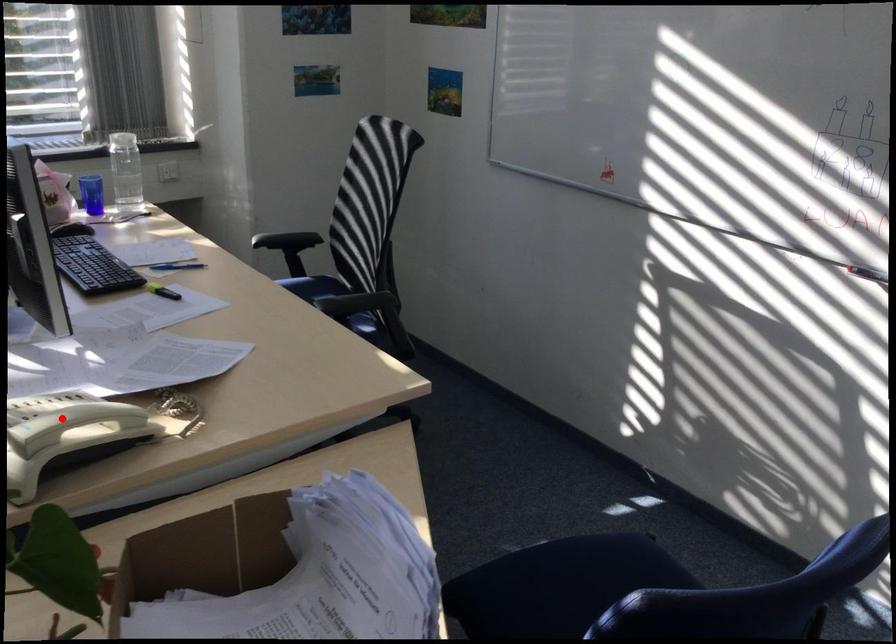
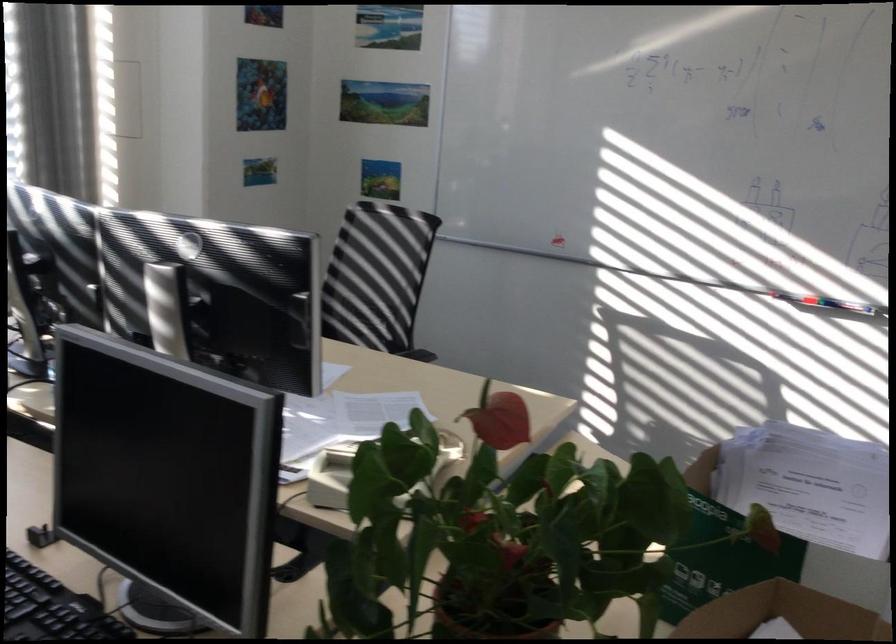
Question: I am providing you with two images of the same scene from different viewpoints. A red point is marked on the first image. At the location where the point appears in image 1, is it still visible in image 2?

Choices:
 (A) Yes
 (B) No

Answer: (B)